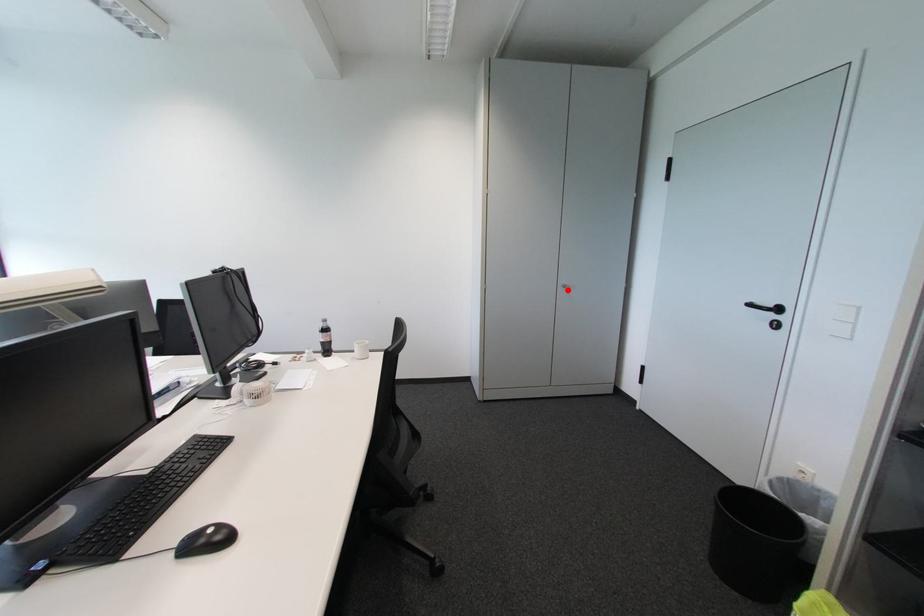
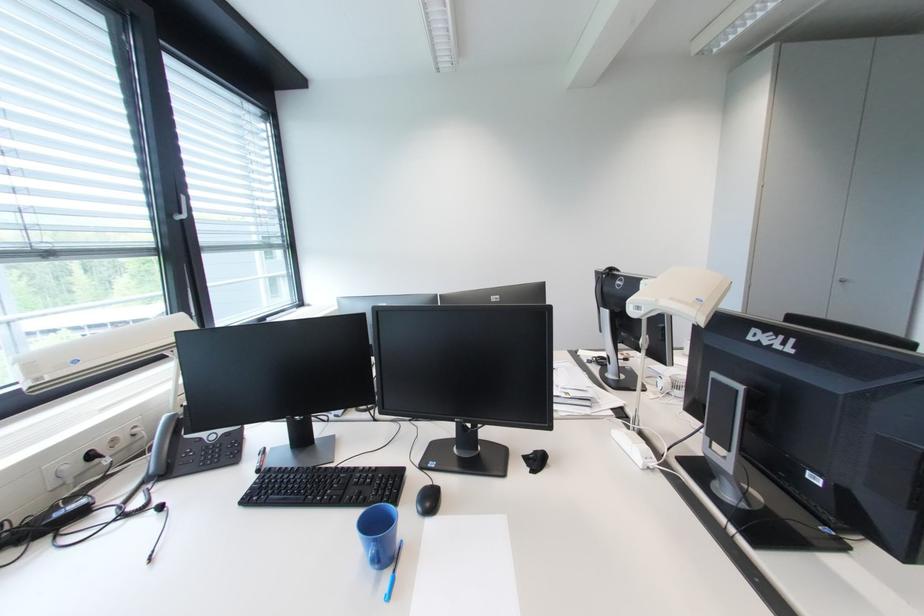
The point at the highlighted location is marked in the first image. Where is the corresponding point in the second image?

(844, 285)